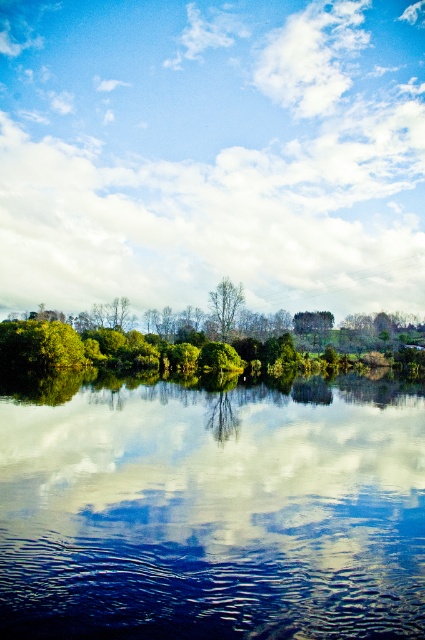
Which of these two, green matte tree at center or smooth glass water at center, stands taller?

Standing taller between the two is green matte tree at center.

Describe the element at coordinates (226, 304) in the screenshot. The width and height of the screenshot is (425, 640). I see `green matte tree at center` at that location.

Where is `green matte tree at center`? The image size is (425, 640). green matte tree at center is located at coordinates (226, 304).

Does white fluffy cloud at upper center appear on the right side of transparent glass water at center?

Incorrect, white fluffy cloud at upper center is not on the right side of transparent glass water at center.

Is white fluffy cloud at upper center thinner than transparent glass water at center?

In fact, white fluffy cloud at upper center might be wider than transparent glass water at center.

Does point (34, 104) come in front of point (28, 397)?

No, it is not.

Find the location of a particular element. white fluffy cloud at upper center is located at coordinates (212, 154).

Which is in front, point (226, 614) or point (231, 310)?

Point (226, 614) is in front.

Can you confirm if transparent glass water at center is thinner than green matte tree at center?

Incorrect, transparent glass water at center's width is not less than green matte tree at center's.

Between point (76, 609) and point (232, 292), which one is positioned in front?

Point (76, 609) is more forward.

Locate an element on the screen. transparent glass water at center is located at coordinates pos(212,512).